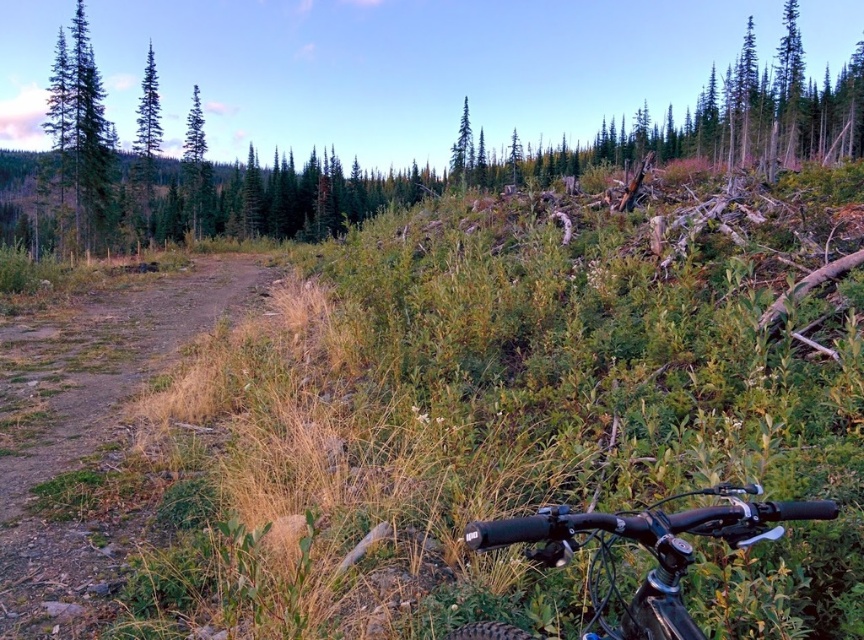
Between black matte bicycle handlebars at lower right and green textured tree at upper left, which one appears on the right side from the viewer's perspective?

black matte bicycle handlebars at lower right is more to the right.

Can you confirm if black matte bicycle handlebars at lower right is positioned below green textured tree at upper left?

Indeed, black matte bicycle handlebars at lower right is positioned under green textured tree at upper left.

Between point (691, 490) and point (183, 170), which one is positioned in front?

Point (691, 490) is more forward.

The image size is (864, 640). I want to click on black matte bicycle handlebars at lower right, so click(x=646, y=548).

Is dirt/gravel path at left smaller than green matte tree at upper left?

No.

What do you see at coordinates (91, 426) in the screenshot? The height and width of the screenshot is (640, 864). I see `dirt/gravel path at left` at bounding box center [91, 426].

Where is `dirt/gravel path at left`? dirt/gravel path at left is located at coordinates (91, 426).

Who is taller, green textured tree at upper left or green matte tree at upper center?

Standing taller between the two is green matte tree at upper center.

Is point (194, 157) positioned in front of point (469, 164)?

Yes.

Locate an element on the screen. This screenshot has height=640, width=864. green textured tree at upper left is located at coordinates (195, 168).

Image resolution: width=864 pixels, height=640 pixels. Find the location of `green textured tree at upper left`. green textured tree at upper left is located at coordinates (195, 168).